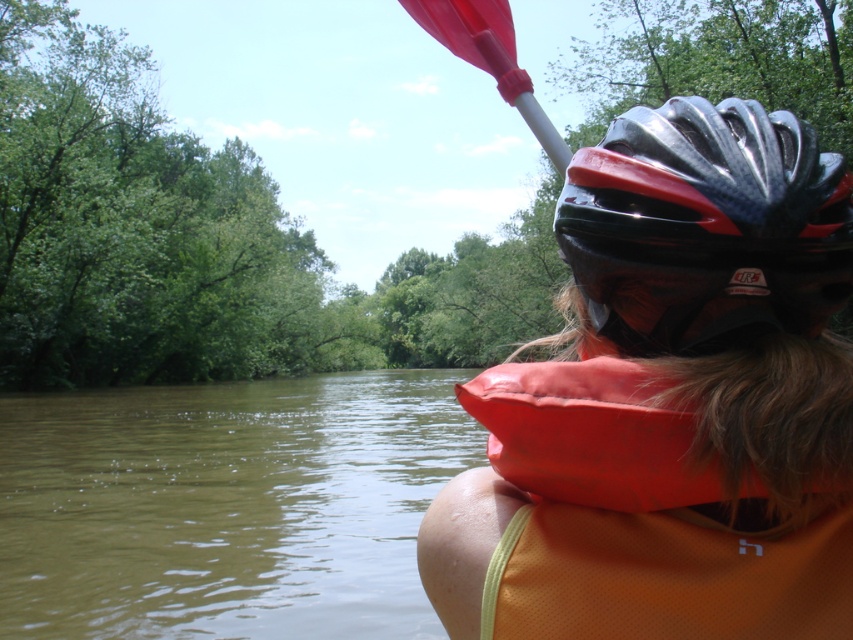
Can you confirm if orange fabric life jacket at lower right is smaller than rubber paddle at upper center?

Yes, orange fabric life jacket at lower right is smaller than rubber paddle at upper center.

Between orange fabric life jacket at lower right and rubber paddle at upper center, which one appears on the right side from the viewer's perspective?

orange fabric life jacket at lower right

Is point (676, 506) less distant than point (445, 8)?

Yes, it is in front of point (445, 8).

I want to click on orange fabric life jacket at lower right, so click(x=643, y=516).

Is orange fabric life jacket at lower right further to camera compared to black/glossy bicycle helmet at center?

That is False.

How distant is orange fabric life jacket at lower right from black/glossy bicycle helmet at center?

orange fabric life jacket at lower right is 10.15 inches from black/glossy bicycle helmet at center.

Which is in front, point (521, 600) or point (724, 221)?

Positioned in front is point (521, 600).

In order to click on orange fabric life jacket at lower right in this screenshot , I will do `click(643, 516)`.

Does shiny black helmet at upper right have a greater height compared to brown murky water at lower left?

No, shiny black helmet at upper right is not taller than brown murky water at lower left.

Which is behind, point (636, 595) or point (190, 570)?

Point (190, 570)

You are a GUI agent. You are given a task and a screenshot of the screen. Output one action in this format:
    pyautogui.click(x=<x>, y=<y>)
    Task: Click on the shiny black helmet at upper right
    
    Given the screenshot: What is the action you would take?
    pyautogui.click(x=670, y=401)